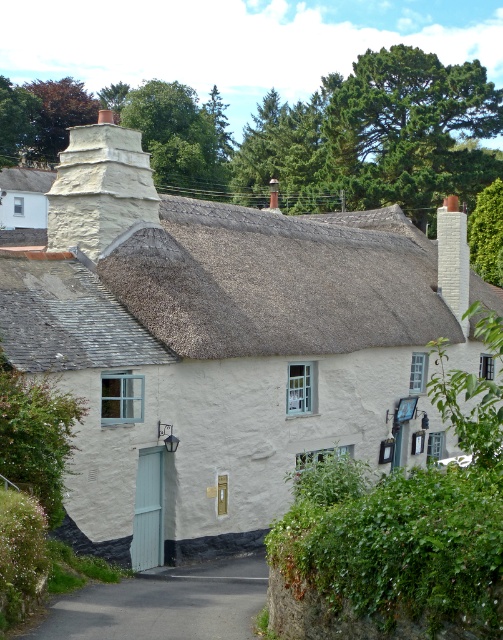
Question: Which point appears closest to the camera in this image?

Choices:
 (A) click(x=96, y=154)
 (B) click(x=207, y=356)

Answer: (B)

Question: Based on their relative distances, which object is farther from the thatched roof at upper center?

Choices:
 (A) white stone chimney at upper center
 (B) white stucco cottage at center
 (C) asphalt road at lower center

Answer: (C)

Question: Which of the following is the closest to the observer?

Choices:
 (A) (159, 330)
 (B) (145, 193)

Answer: (A)

Question: Is asphalt road at lower center wider than white stone chimney at upper center?

Choices:
 (A) yes
 (B) no

Answer: (A)

Question: Can you confirm if white stucco cottage at center is positioned to the left of thatched roof at upper center?

Choices:
 (A) yes
 (B) no

Answer: (A)

Question: Is white stucco cottage at center positioned in front of asphalt road at lower center?

Choices:
 (A) no
 (B) yes

Answer: (A)